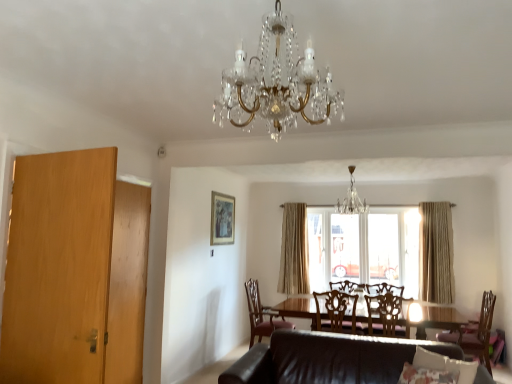
Question: Considering the relative sizes of gold-framed picture at upper center and wooden chair at center, which appears as the second chair when viewed from the right, in the image provided, is gold-framed picture at upper center taller than wooden chair at center, which appears as the second chair when viewed from the right,?

Choices:
 (A) yes
 (B) no

Answer: (A)

Question: Considering the relative sizes of gold-framed picture at upper center and wooden chair at center, marked as the third chair in a left-to-right arrangement, in the image provided, is gold-framed picture at upper center wider than wooden chair at center, marked as the third chair in a left-to-right arrangement,?

Choices:
 (A) no
 (B) yes

Answer: (A)

Question: Is gold-framed picture at upper center smaller than wooden chair at center, which appears as the second chair when viewed from the right?

Choices:
 (A) no
 (B) yes

Answer: (B)

Question: Does gold-framed picture at upper center have a lesser width compared to wooden chair at center, marked as the third chair in a left-to-right arrangement?

Choices:
 (A) no
 (B) yes

Answer: (B)

Question: Does gold-framed picture at upper center contain wooden chair at center, which appears as the second chair when viewed from the right?

Choices:
 (A) yes
 (B) no

Answer: (B)

Question: Is gold-framed picture at upper center directly adjacent to wooden chair at center, marked as the third chair in a left-to-right arrangement?

Choices:
 (A) yes
 (B) no

Answer: (B)

Question: From a real-world perspective, is wooden chair at center, which appears as the second chair when viewed from the right, beneath brown leather chair at lower center, the first chair when ordered from left to right?

Choices:
 (A) yes
 (B) no

Answer: (B)

Question: Is wooden chair at center, which appears as the second chair when viewed from the right, not close to brown leather chair at lower center, arranged as the fourth chair when viewed from the right?

Choices:
 (A) yes
 (B) no

Answer: (A)

Question: Does wooden chair at center, which appears as the second chair when viewed from the right, have a smaller size compared to brown leather chair at lower center, arranged as the fourth chair when viewed from the right?

Choices:
 (A) yes
 (B) no

Answer: (A)

Question: Does wooden chair at center, marked as the third chair in a left-to-right arrangement, have a greater width compared to brown leather chair at lower center, the first chair when ordered from left to right?

Choices:
 (A) yes
 (B) no

Answer: (B)

Question: Considering the relative sizes of wooden chair at center, marked as the third chair in a left-to-right arrangement, and brown leather chair at lower center, the first chair when ordered from left to right, in the image provided, is wooden chair at center, marked as the third chair in a left-to-right arrangement, thinner than brown leather chair at lower center, the first chair when ordered from left to right,?

Choices:
 (A) no
 (B) yes

Answer: (B)

Question: Can you confirm if wooden chair at center, which appears as the second chair when viewed from the right, is taller than brown leather chair at lower center, the first chair when ordered from left to right?

Choices:
 (A) yes
 (B) no

Answer: (B)

Question: Is wooden chair at center, marked as the third chair in a left-to-right arrangement, in front of wooden door at left?

Choices:
 (A) no
 (B) yes

Answer: (A)